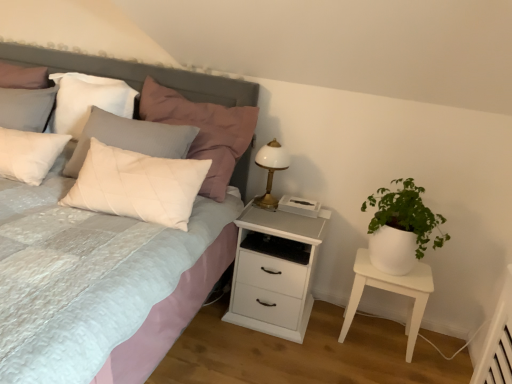
The width and height of the screenshot is (512, 384). I want to click on free spot in front of white matte nightstand at center, so click(266, 358).